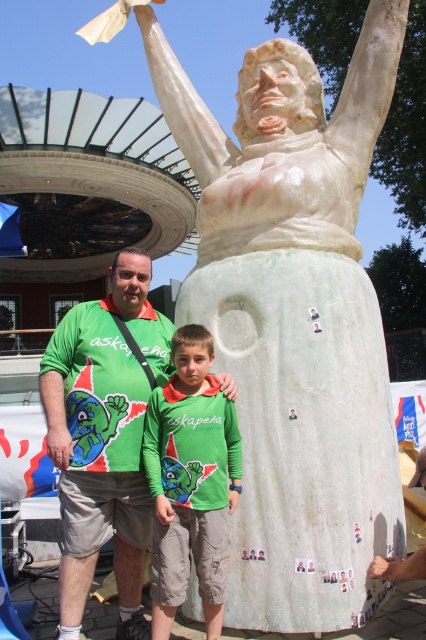
Question: Is green fabric shirt at center smaller than green matte shirt at center?

Choices:
 (A) no
 (B) yes

Answer: (B)

Question: Can you confirm if green fabric shirt at center is bigger than green matte shirt at center?

Choices:
 (A) yes
 (B) no

Answer: (B)

Question: Among these points, which one is nearest to the camera?

Choices:
 (A) (210, 349)
 (B) (98, 317)

Answer: (A)

Question: Can you confirm if green fabric shirt at center is bigger than green matte shirt at center?

Choices:
 (A) yes
 (B) no

Answer: (B)